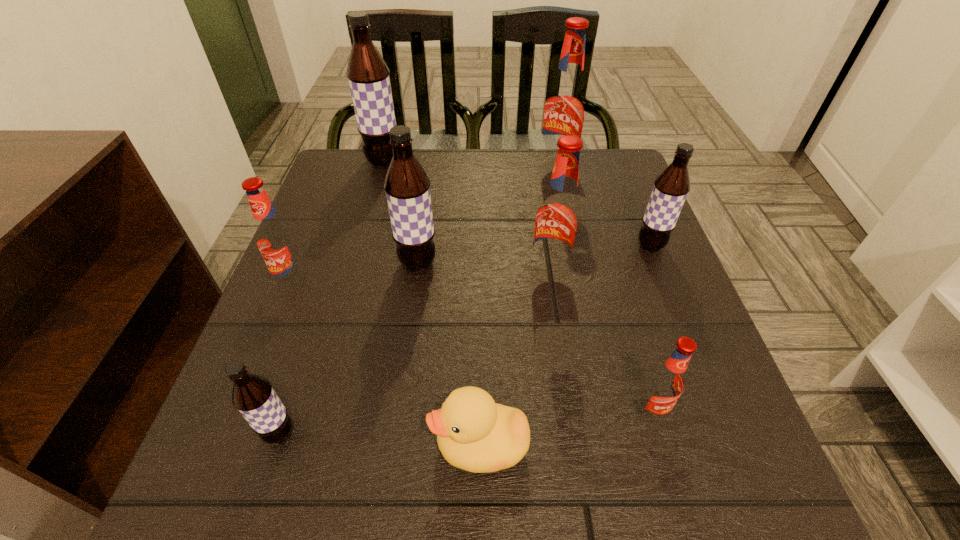
Identify the location of free space between the biggest brown root beer and the rightmost brown root beer. The image size is (960, 540). (516, 204).

I want to click on free space between the smallest brown root beer and the biggest red root beer, so click(419, 301).

Select which object is the third closest to the fourth object from left to right. Please provide its 2D coordinates. Your answer should be formatted as a tuple, i.e. [(x, y)], where the tuple contains the x and y coordinates of a point satisfying the conditions above.

[(474, 433)]

Image resolution: width=960 pixels, height=540 pixels. What are the coordinates of `object that stands as the fourth closest to the smallest brown root beer` in the screenshot? It's located at (558, 218).

Locate an element on the screen. This screenshot has width=960, height=540. root beer object that ranks as the fifth closest to the smallest red root beer is located at coordinates (565, 107).

Identify which root beer is located as the nearest to the sixth object from right to left. Please provide its 2D coordinates. Your answer should be formatted as a tuple, i.e. [(x, y)], where the tuple contains the x and y coordinates of a point satisfying the conditions above.

[(274, 237)]

Where is `brown root beer that is the second closest to the farthest brown root beer`? Image resolution: width=960 pixels, height=540 pixels. brown root beer that is the second closest to the farthest brown root beer is located at coordinates (671, 187).

Where is `brown root beer that can be found as the closest to the nearest brown root beer`? brown root beer that can be found as the closest to the nearest brown root beer is located at coordinates (407, 186).

This screenshot has width=960, height=540. I want to click on red root beer that is the third closest to the biggest red root beer, so click(665, 383).

Where is `red root beer that stands as the fourth closest to the biggest brown root beer`? The height and width of the screenshot is (540, 960). red root beer that stands as the fourth closest to the biggest brown root beer is located at coordinates (665, 383).